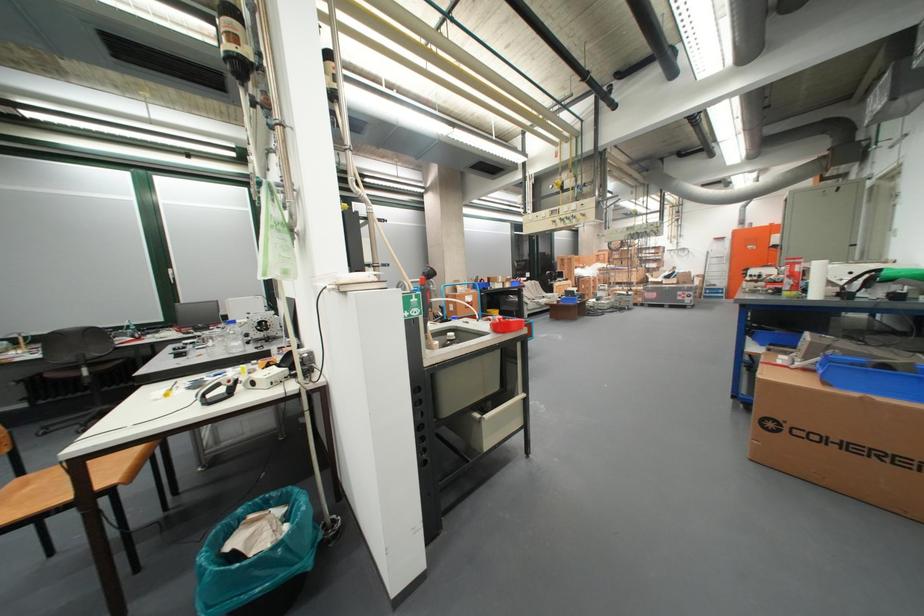
Describe the element at coordinates (25, 496) in the screenshot. The width and height of the screenshot is (924, 616). I see `the wooden chair sitting surface` at that location.